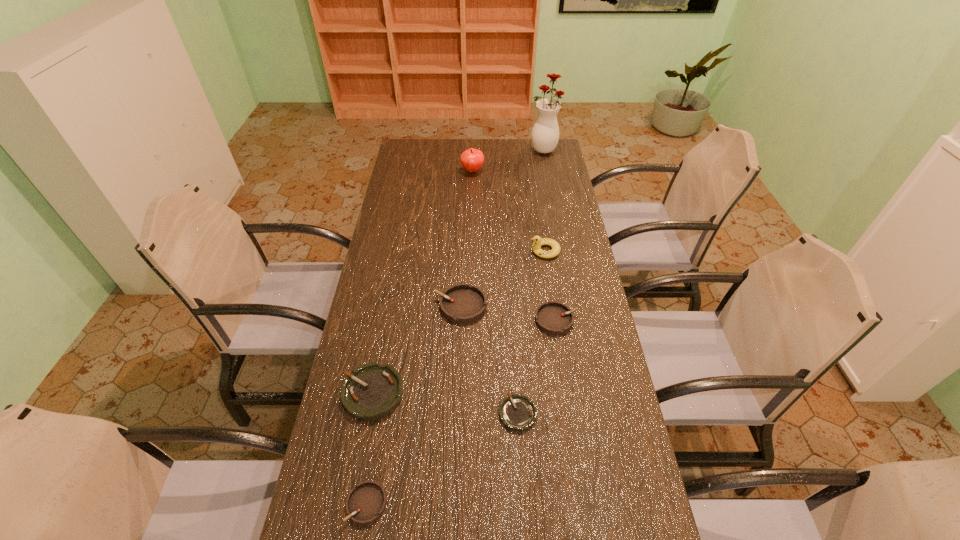
Find the location of `the sixth closest object relative to the seventh tallest object`. the sixth closest object relative to the seventh tallest object is located at coordinates (472, 159).

This screenshot has height=540, width=960. What are the coordinates of `object that is the nearest to the farthest object` in the screenshot? It's located at (472, 159).

The height and width of the screenshot is (540, 960). Find the location of `the third closest ashtray to the tallest object`. the third closest ashtray to the tallest object is located at coordinates (372, 391).

The image size is (960, 540). In order to click on ashtray that is the closest to the second tallest object in this screenshot , I will do `click(462, 303)`.

The height and width of the screenshot is (540, 960). Identify the location of gray ashtray that is the closest to the bigger green ashtray. (366, 502).

Locate an element on the screen. The height and width of the screenshot is (540, 960). gray ashtray that is the closest one to the rightmost gray ashtray is located at coordinates (462, 303).

You are a GUI agent. You are given a task and a screenshot of the screen. Output one action in this format:
    pyautogui.click(x=<x>, y=<y>)
    Task: Click on the green ashtray that can be found as the second closest to the biggest gray ashtray
    Image resolution: width=960 pixels, height=540 pixels.
    Given the screenshot: What is the action you would take?
    pyautogui.click(x=518, y=413)

Find the location of a particular element. The height and width of the screenshot is (540, 960). vacant space that satisfies the following two spatial constraints: 1. on the back side of the second shortest ashtray; 2. on the left side of the shortest object is located at coordinates (382, 414).